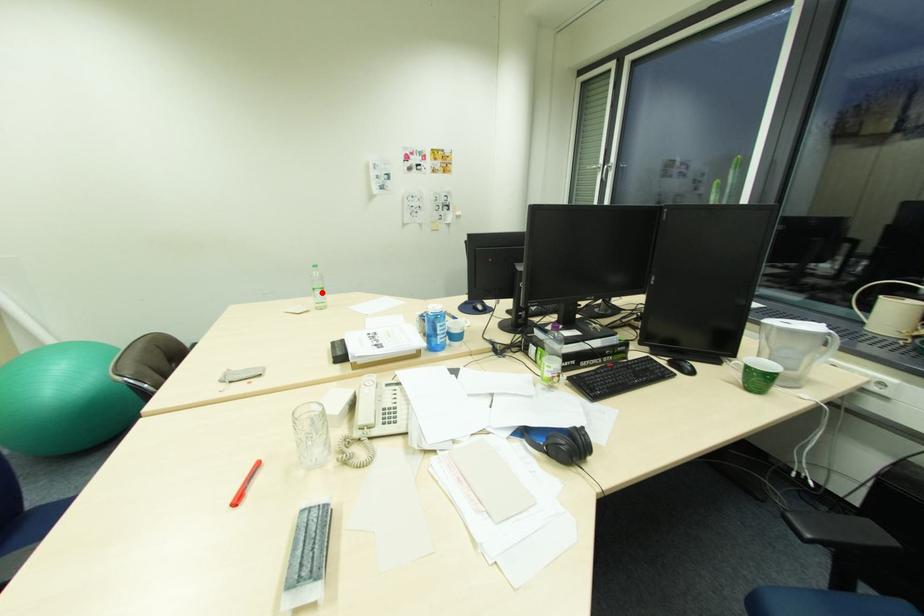
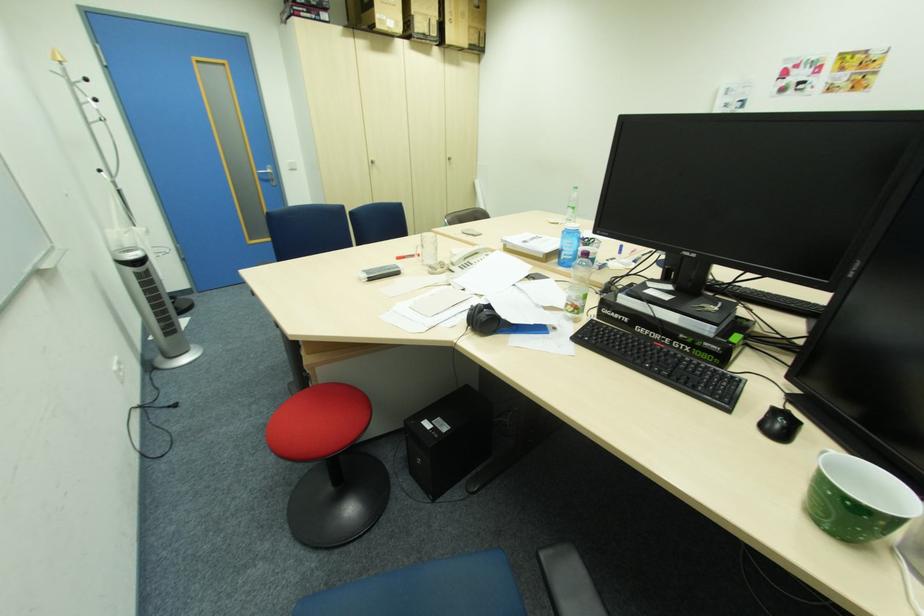
Question: I am providing you with two images of the same scene from different viewpoints. Given a red point in image1, look at the same physical point in image2. Is it:

Choices:
 (A) Closer to the viewpoint
 (B) Farther from the viewpoint

Answer: (B)